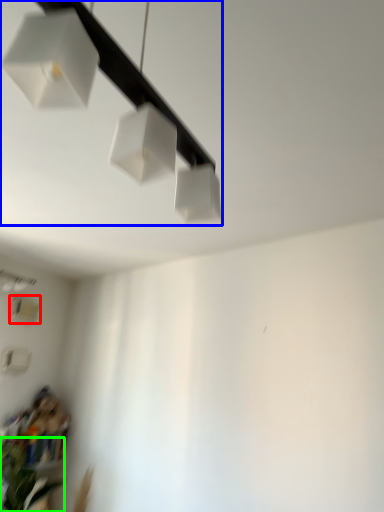
Question: Which is nearer to the lamp (highlighted by a red box)? lamp (highlighted by a blue box) or plant (highlighted by a green box).

Choices:
 (A) lamp
 (B) plant

Answer: (B)